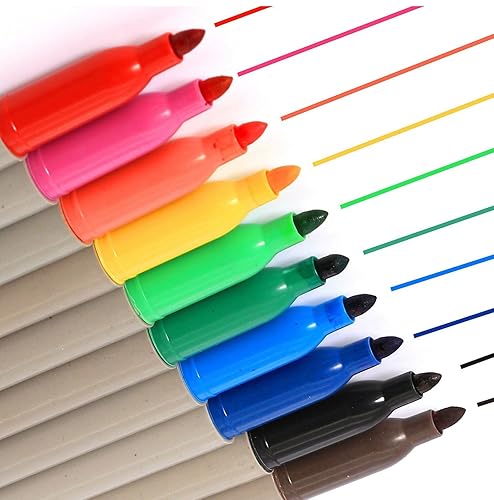
You are a GUI agent. You are given a task and a screenshot of the screen. Output one action in this format:
    pyautogui.click(x=<x>, y=<y>)
    Task: Click on the marker
    The height and width of the screenshot is (500, 494).
    Given the screenshot: What is the action you would take?
    pyautogui.click(x=356, y=454), pyautogui.click(x=329, y=430), pyautogui.click(x=294, y=391), pyautogui.click(x=254, y=356), pyautogui.click(x=221, y=307), pyautogui.click(x=198, y=272), pyautogui.click(x=166, y=225), pyautogui.click(x=148, y=195), pyautogui.click(x=100, y=146), pyautogui.click(x=43, y=116)